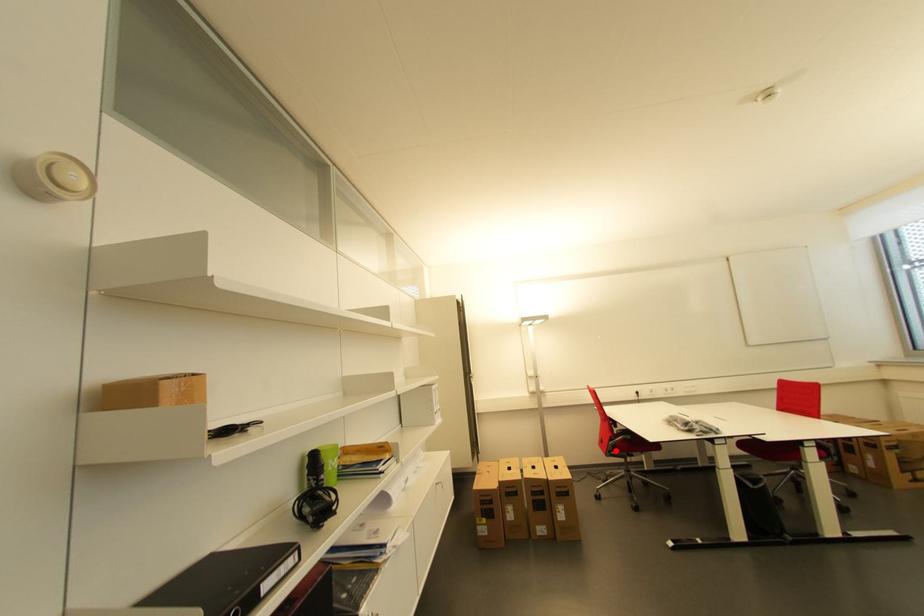
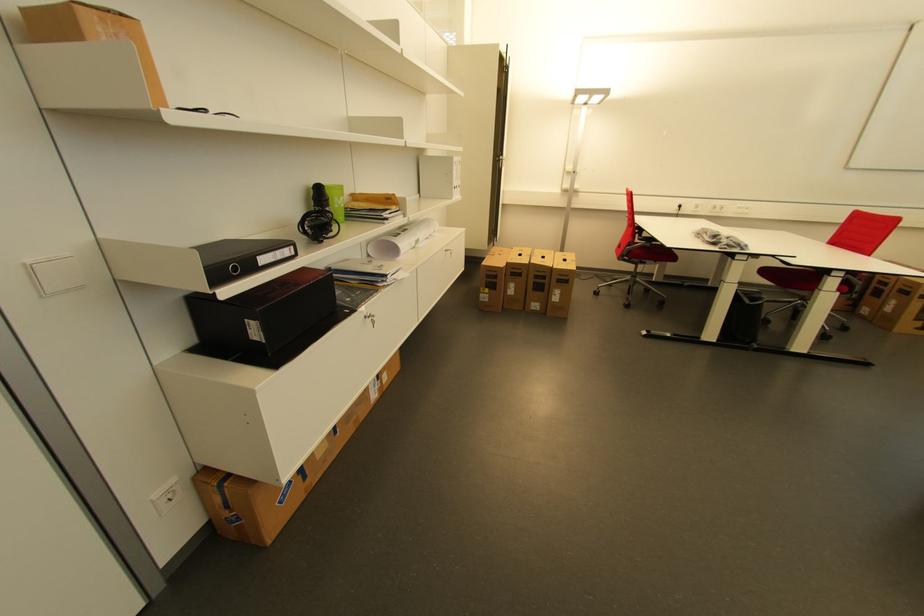
The point at the highlighted location is marked in the first image. Where is the corresponding point in the second image?

(629, 254)